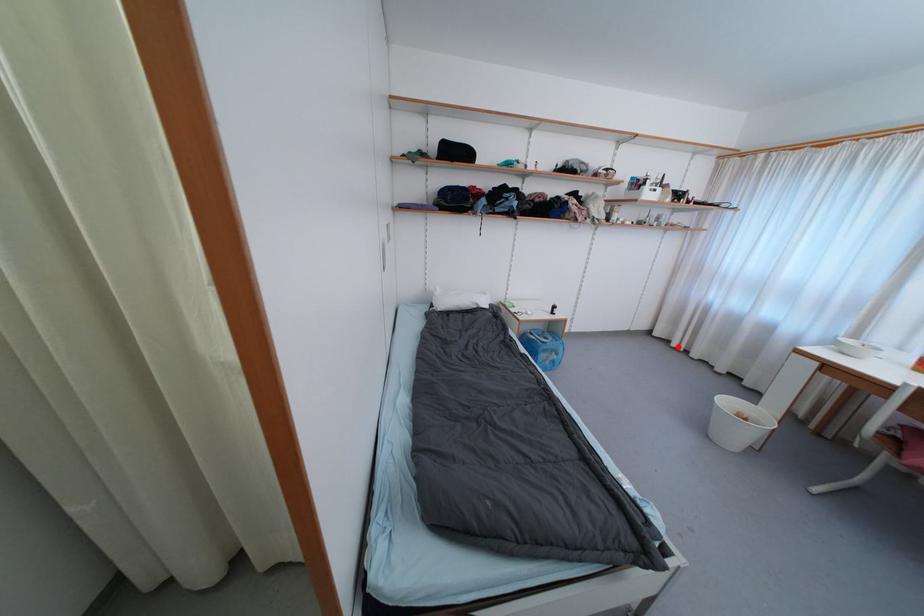
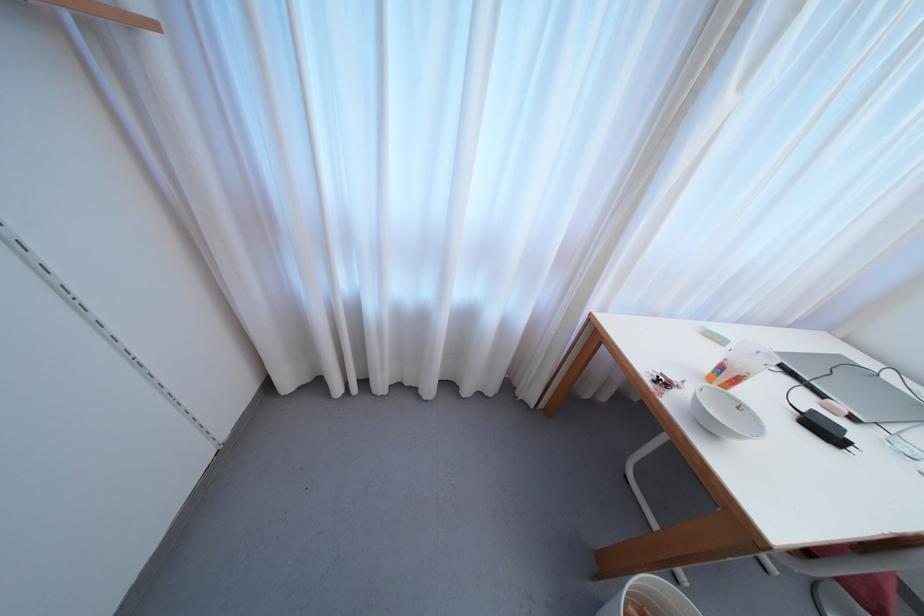
The point at the highlighted location is marked in the first image. Where is the corresponding point in the second image?

(342, 392)